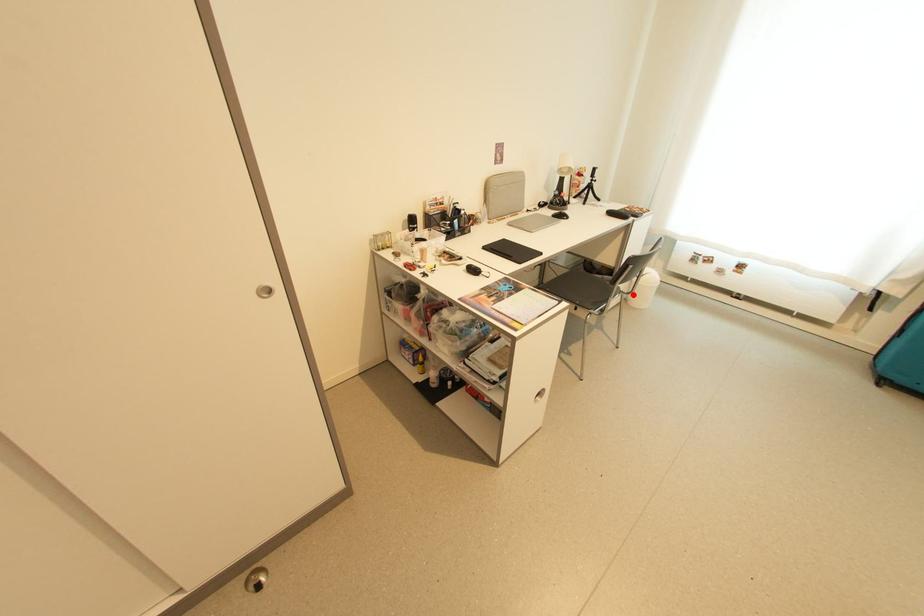
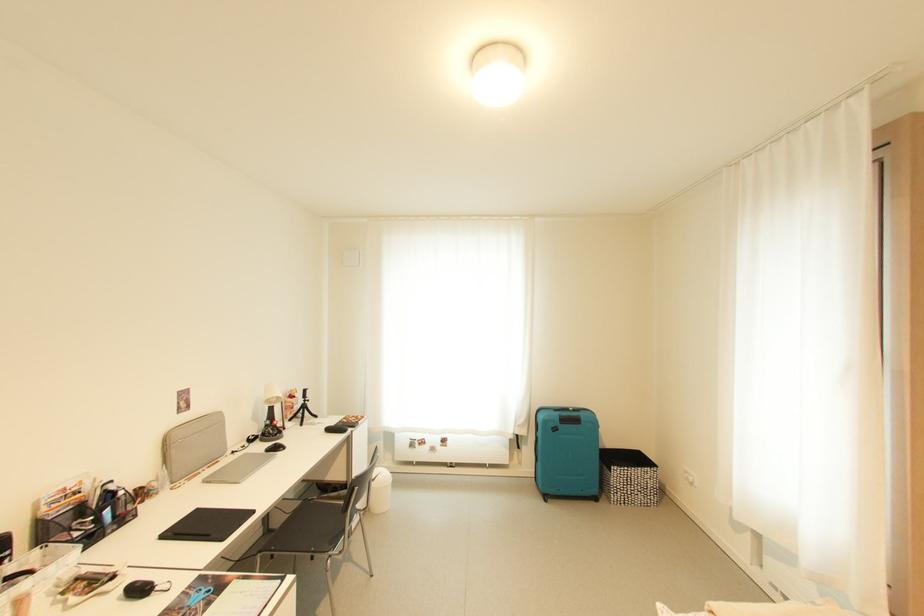
Question: I am providing you with two images of the same scene from different viewpoints. Given a red point in image1, look at the same physical point in image2. Is it:

Choices:
 (A) Closer to the viewpoint
 (B) Farther from the viewpoint

Answer: (A)